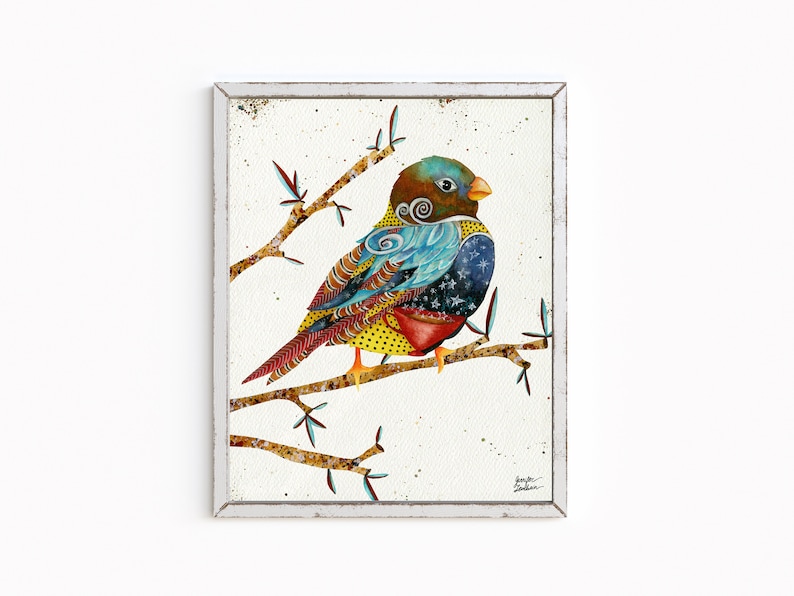
Find the location of `art`. art is located at coordinates (415, 263).